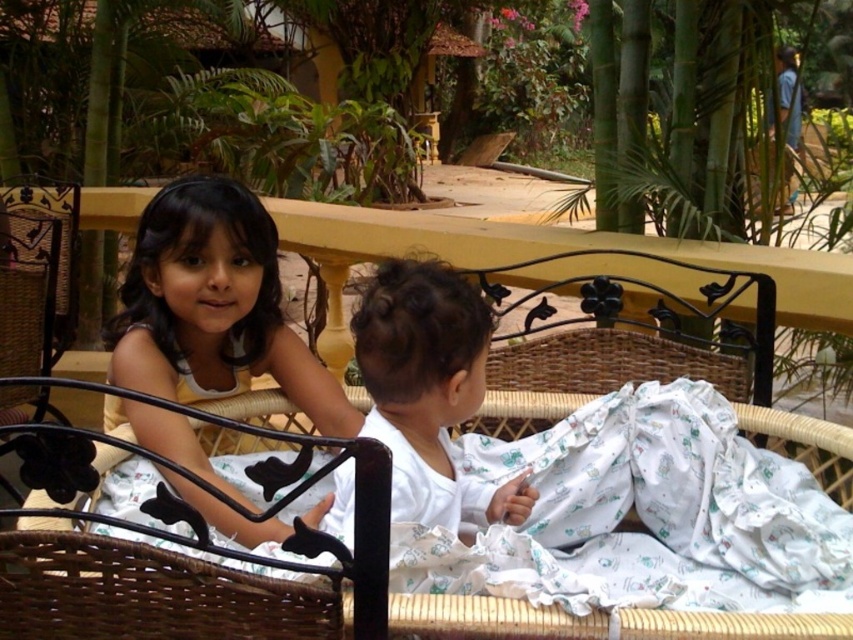
You are a photographer setting up a shot of the two children on the wicker bed. You want to ensure both the matte yellow dress at upper left and the white soft fabric at center are clearly visible. Which object should you focus on first if you want to highlight the larger one?

The matte yellow dress at upper left is larger in size than the white soft fabric at center, so you should focus on the matte yellow dress at upper left first to highlight the larger object.

You are a photographer trying to capture a closeup of the white soft fabric at center while also including the matte yellow dress at upper left in the frame. Given that your camera has a maximum focus range of 10 inches, will you be able to capture both objects clearly in the same photo?

The distance between the matte yellow dress at upper left and the white soft fabric at center is 9.74 inches, which is within the camera maximum focus range of 10 inches. Therefore, you can capture both objects clearly in the same photo.